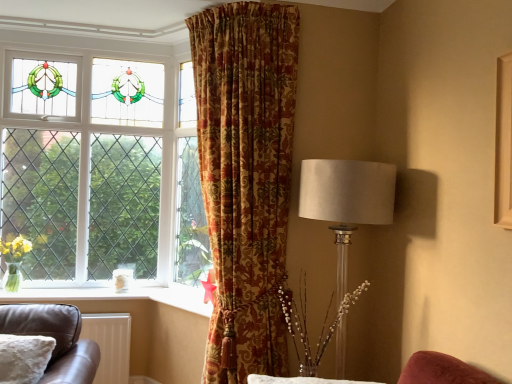
Question: Is white matte radiator at lower left bigger than satin white lampshade at right?

Choices:
 (A) yes
 (B) no

Answer: (B)

Question: From a real-world perspective, is white matte radiator at lower left positioned under satin white lampshade at right based on gravity?

Choices:
 (A) yes
 (B) no

Answer: (A)

Question: Is white matte radiator at lower left thinner than satin white lampshade at right?

Choices:
 (A) no
 (B) yes

Answer: (B)

Question: Is white matte radiator at lower left looking in the opposite direction of satin white lampshade at right?

Choices:
 (A) no
 (B) yes

Answer: (A)

Question: Can you confirm if white matte radiator at lower left is shorter than satin white lampshade at right?

Choices:
 (A) no
 (B) yes

Answer: (B)

Question: From the image's perspective, is white matte radiator at lower left beneath satin white lampshade at right?

Choices:
 (A) yes
 (B) no

Answer: (A)

Question: Is white matte radiator at lower left bigger than gold-patterned curtain at center?

Choices:
 (A) no
 (B) yes

Answer: (A)

Question: From the image's perspective, does white matte radiator at lower left appear lower than gold-patterned curtain at center?

Choices:
 (A) no
 (B) yes

Answer: (B)

Question: From a real-world perspective, is white matte radiator at lower left over gold-patterned curtain at center?

Choices:
 (A) yes
 (B) no

Answer: (B)

Question: Is white matte radiator at lower left positioned beyond the bounds of gold-patterned curtain at center?

Choices:
 (A) yes
 (B) no

Answer: (A)

Question: Is the depth of white matte radiator at lower left less than that of gold-patterned curtain at center?

Choices:
 (A) no
 (B) yes

Answer: (A)

Question: Considering the relative positions of white matte radiator at lower left and gold-patterned curtain at center in the image provided, is white matte radiator at lower left to the left of gold-patterned curtain at center from the viewer's perspective?

Choices:
 (A) no
 (B) yes

Answer: (B)

Question: Is clear glass window at upper left taller than white matte radiator at lower left?

Choices:
 (A) no
 (B) yes

Answer: (B)